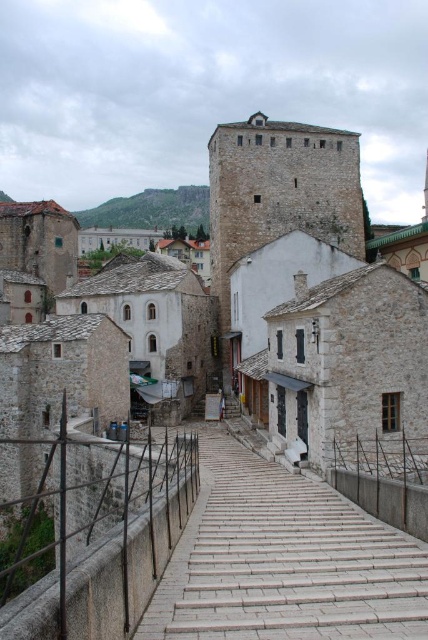
Looking at this image, you are a tourist standing at the base of the historic stone bridge. You see the white stone tower at center and the green stone cliff at upper center. Which object is larger in size?

The white stone tower at center is smaller than the green stone cliff at upper center, so the green stone cliff at upper center is larger in size.

You are a tourist standing on the historic stone bridge and want to take a photo of the white stone tower at center and the green stone cliff at upper center. Which object should you look upwards to capture in your photo?

You should look upwards to capture the green stone cliff at upper center in your photo since it is located above the white stone tower at center.